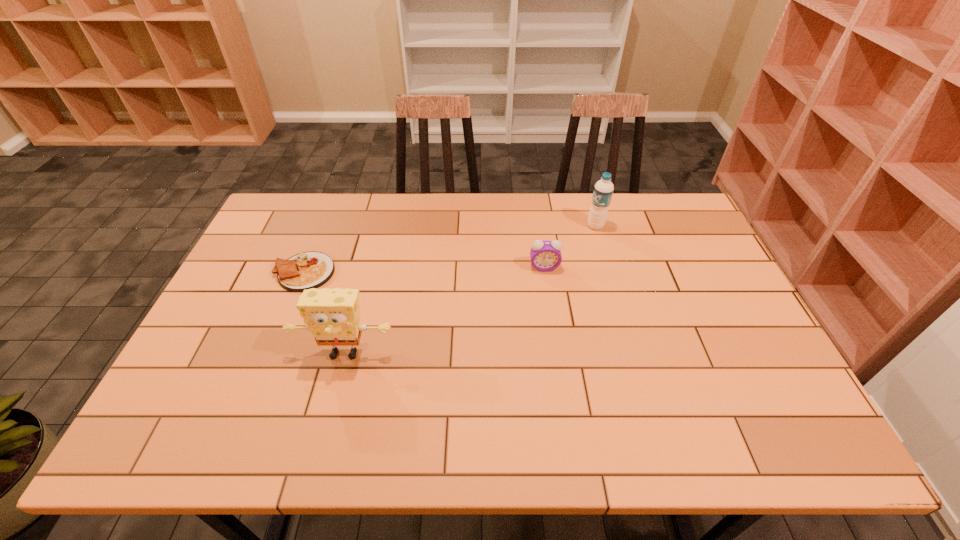
At what (x,y) coordinates should I click in order to perform the action: click on the farthest object. Please return your answer as a coordinate pair (x, y). The image size is (960, 540). Looking at the image, I should click on click(603, 190).

The height and width of the screenshot is (540, 960). In order to click on water bottle in this screenshot , I will do `click(603, 190)`.

You are a GUI agent. You are given a task and a screenshot of the screen. Output one action in this format:
    pyautogui.click(x=<x>, y=<y>)
    Task: Click on the nearest object
    The width and height of the screenshot is (960, 540).
    Given the screenshot: What is the action you would take?
    [x=332, y=315]

At what (x,y) coordinates should I click in order to perform the action: click on the third tallest object. Please return your answer as a coordinate pair (x, y). Looking at the image, I should click on (545, 255).

Find the location of a particular element. The width and height of the screenshot is (960, 540). the second object from right to left is located at coordinates (545, 255).

Find the location of `the shortest object`. the shortest object is located at coordinates (306, 270).

Locate an element on the screen. The height and width of the screenshot is (540, 960). vacant space located 0.060m on the label of the rightmost object is located at coordinates (569, 226).

Where is `vacant space located 0.290m on the label of the rightmost object`? The width and height of the screenshot is (960, 540). vacant space located 0.290m on the label of the rightmost object is located at coordinates (501, 226).

Identify the location of vacant space positioned on the label of the rightmost object. (540, 226).

Locate an element on the screen. Image resolution: width=960 pixels, height=540 pixels. free space located on the face of the sponge is located at coordinates (328, 414).